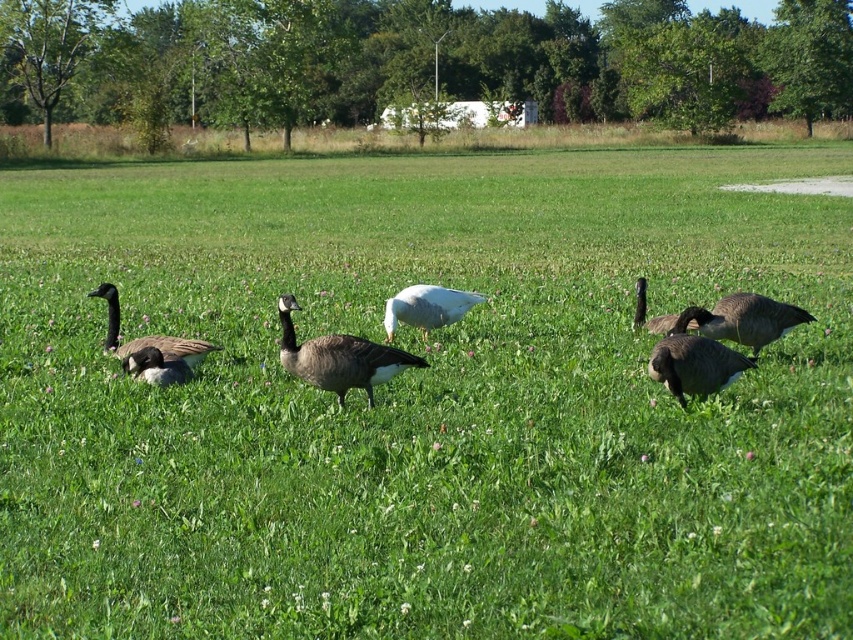
You are a photographer trying to capture a photo of the dark gray matte goose at center and the dark brown feathered goose at right. If you want to frame both geese in the same shot, which direction should you move your camera to include both geese?

You should move your camera to the left to include both the dark gray matte goose at center and the dark brown feathered goose at right since the dark gray matte goose at center is to the left of the dark brown feathered goose at right.

Looking at this image, you are standing in the field observing the geese. Which goose is closer to you, the dark gray matte goose at center or the dark brown feathered goose at right?

The dark gray matte goose at center is closer to you because it is in front of the dark brown feathered goose at right.

You are a wildlife photographer trying to capture a photo of the gray matte goose at right and the white matte duck at center. You want to ensure both are visible in the frame. Given their sizes, which one might you need to adjust your camera focus for to ensure clarity?

The gray matte goose at right is larger than the white matte duck at center, so you might need to adjust the camera focus to accommodate the larger size of the gray matte goose at right to ensure both are clearly visible.